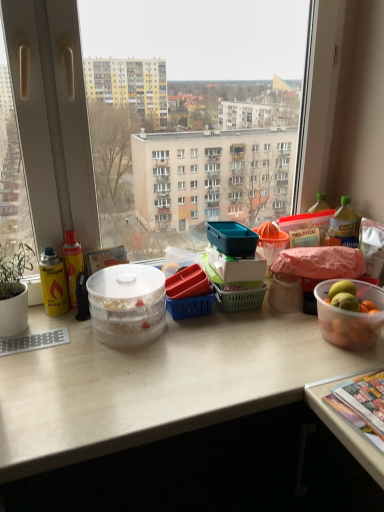
You are a GUI agent. You are given a task and a screenshot of the screen. Output one action in this format:
    pyautogui.click(x=<x>, y=<y>)
    Task: Click on the free space in front of translucent plastic bowl at right, which appears as the first bowl when viewed from the right
    
    Given the screenshot: What is the action you would take?
    pyautogui.click(x=342, y=365)